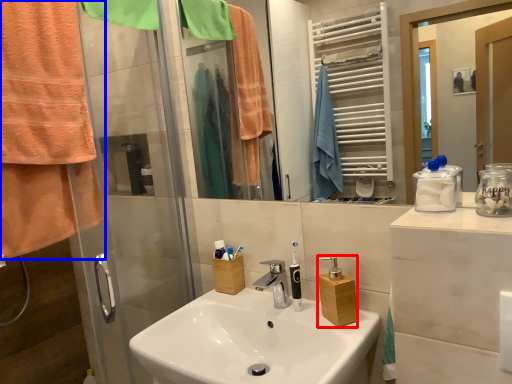
Question: Which of the following is the closest to the observer, bottle (highlighted by a red box) or towel/napkin (highlighted by a blue box)?

Choices:
 (A) bottle
 (B) towel/napkin

Answer: (B)